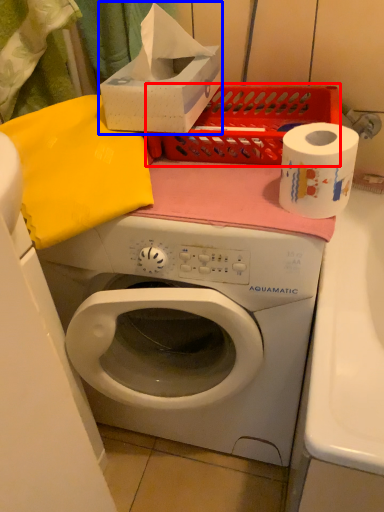
Question: Among these objects, which one is nearest to the camera, crate (highlighted by a red box) or box (highlighted by a blue box)?

Choices:
 (A) crate
 (B) box

Answer: (B)